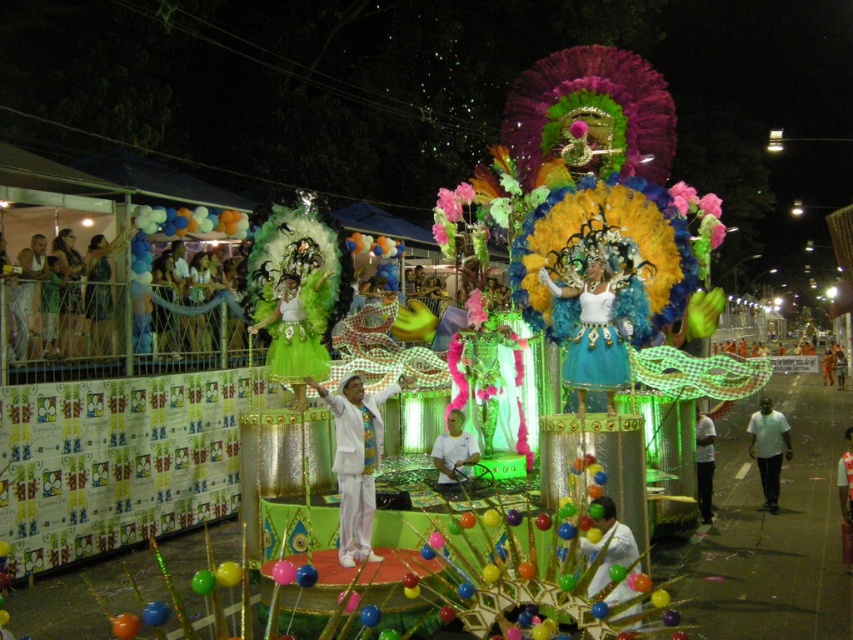
Question: Does turquoise fabric costume at center lie behind white fabric at center?

Choices:
 (A) yes
 (B) no

Answer: (B)

Question: Does white fabric at center have a larger size compared to white satin dress at center?

Choices:
 (A) no
 (B) yes

Answer: (A)

Question: Which of these objects is positioned farthest from the white matte shirt at lower right?

Choices:
 (A) white cotton shirt at center
 (B) white satin dress at center
 (C) white fabric shirt at left

Answer: (C)

Question: Which point appears closest to the camera in this image?

Choices:
 (A) (845, 513)
 (B) (453, 438)
 (C) (32, 243)
 (D) (788, 448)

Answer: (B)

Question: Which of the following is the closest to the observer?

Choices:
 (A) white matte shirt at lower right
 (B) white satin suit at center
 (C) turquoise fabric costume at center

Answer: (B)

Question: Is turquoise fabric costume at center thinner than white fabric shirt at left?

Choices:
 (A) no
 (B) yes

Answer: (A)